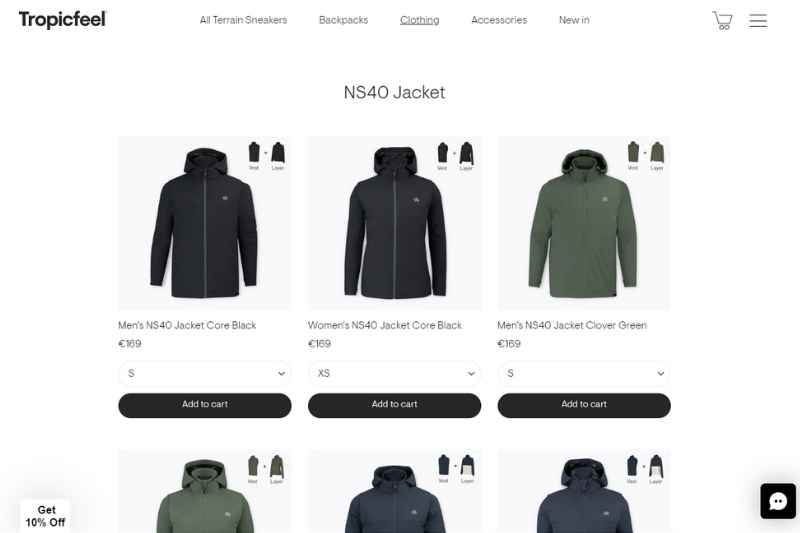
The image size is (800, 533). Identify the location of hoods. (193, 161), (404, 163), (585, 158), (202, 467), (397, 475), (586, 472).